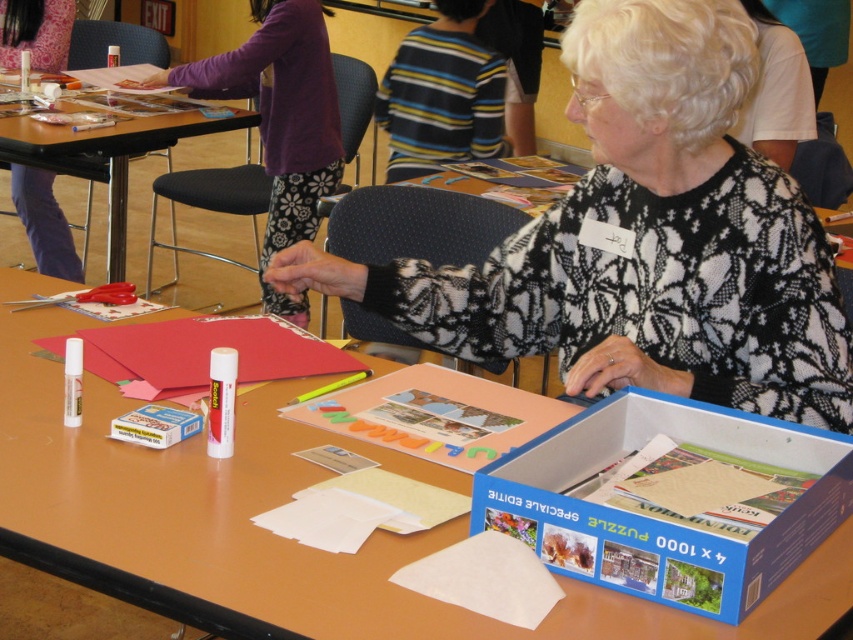
Does purple fabric pants at upper left have a lesser width compared to wooden table at center?

Yes.

From the picture: Does purple fabric pants at upper left have a lesser height compared to wooden table at center?

Incorrect, purple fabric pants at upper left's height does not fall short of wooden table at center's.

You are a GUI agent. You are given a task and a screenshot of the screen. Output one action in this format:
    pyautogui.click(x=<x>, y=<y>)
    Task: Click on the purple fabric pants at upper left
    This screenshot has height=640, width=853.
    Given the screenshot: What is the action you would take?
    pyautogui.click(x=280, y=120)

Which is more to the left, smooth brown table at center or matte black scissors at left?

matte black scissors at left is more to the left.

Can you confirm if smooth brown table at center is taller than matte black scissors at left?

Yes, smooth brown table at center is taller than matte black scissors at left.

You are a GUI agent. You are given a task and a screenshot of the screen. Output one action in this format:
    pyautogui.click(x=<x>, y=<y>)
    Task: Click on the smooth brown table at center
    This screenshot has height=640, width=853.
    Given the screenshot: What is the action you would take?
    pyautogui.click(x=270, y=532)

Is smooth brown table at center below blue cardboard box at center?

No.

Can you confirm if smooth brown table at center is thinner than blue cardboard box at center?

No, smooth brown table at center is not thinner than blue cardboard box at center.

You are a GUI agent. You are given a task and a screenshot of the screen. Output one action in this format:
    pyautogui.click(x=<x>, y=<y>)
    Task: Click on the smooth brown table at center
    
    Given the screenshot: What is the action you would take?
    pyautogui.click(x=270, y=532)